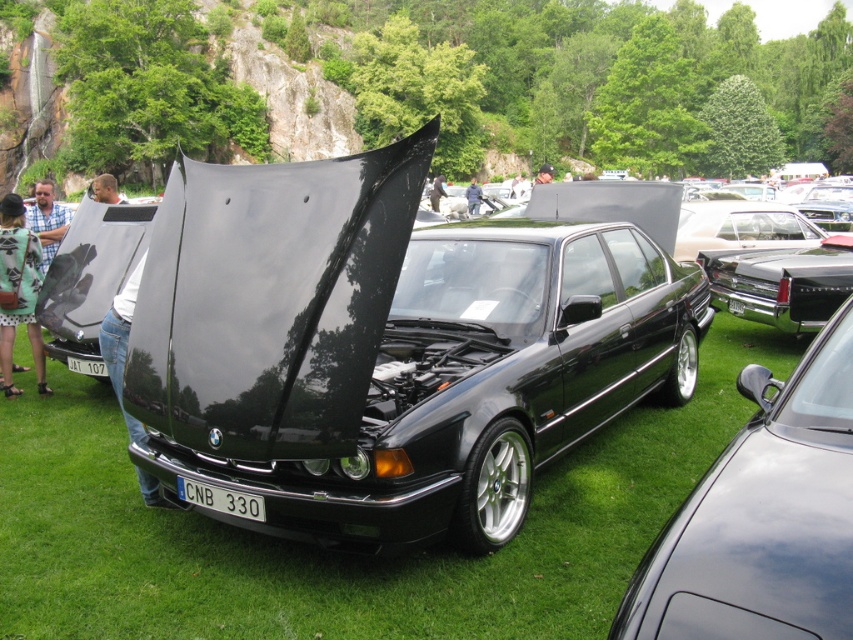
Question: Which object appears closest to the camera in this image?

Choices:
 (A) blue plaid shirt at left
 (B) brown hair at center
 (C) jeans at center
 (D) glossy black car at center

Answer: (D)

Question: Estimate the real-world distances between objects in this image. Which object is farther from the jeans at center?

Choices:
 (A) blue denim jeans at center
 (B) green textured dress at lower left
 (C) black plastic license plate at center

Answer: (A)

Question: Considering the relative positions of blue plaid shirt at left and black plastic license plate at center in the image provided, where is blue plaid shirt at left located with respect to black plastic license plate at center?

Choices:
 (A) left
 (B) right

Answer: (A)

Question: Does blue plaid shirt at left have a greater width compared to black plastic license plate at center?

Choices:
 (A) no
 (B) yes

Answer: (B)

Question: Can you confirm if white plastic license plate at center is wider than blue denim jeans at center?

Choices:
 (A) yes
 (B) no

Answer: (B)

Question: Which is nearer to the black leather jacket at center?

Choices:
 (A) blue denim jeans at center
 (B) glossy black car at center
 (C) green textured dress at lower left
 (D) jeans at center

Answer: (A)